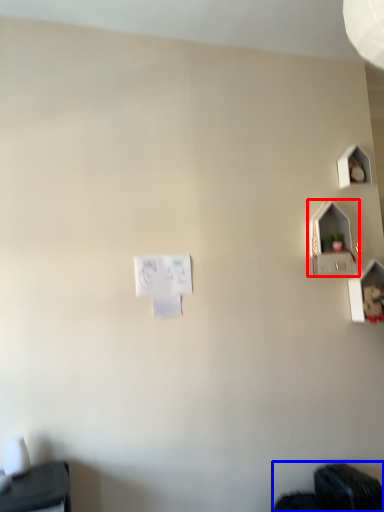
Question: Which object appears closest to the camera in this image, twin (highlighted by a red box) or wide (highlighted by a blue box)?

Choices:
 (A) twin
 (B) wide

Answer: (B)